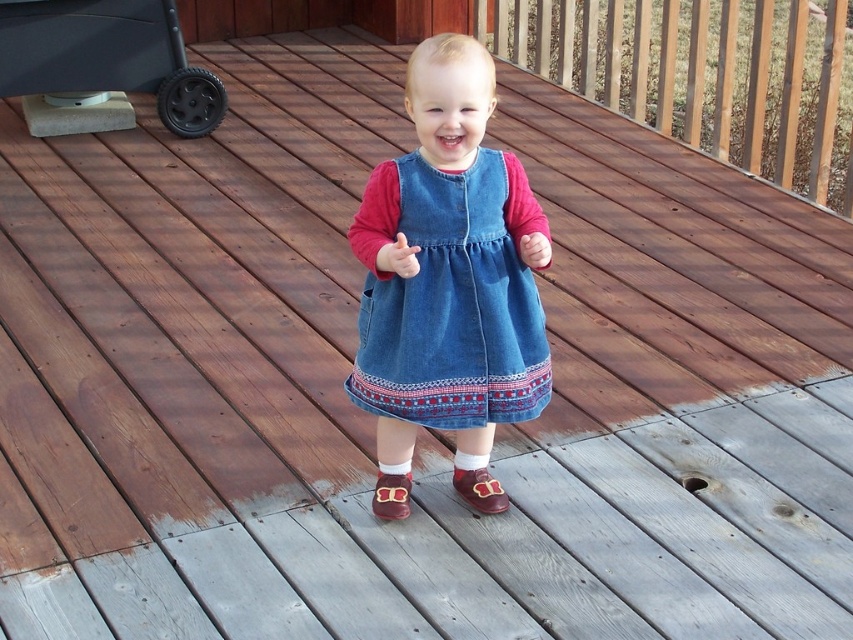
You are a fashion designer observing a child wearing a denim dress at center and brown suede shoe at center. Which clothing item is taller?

The denim dress at center has a greater height compared to the brown suede shoe at center.

The child is standing on a wooden deck. You need to determine if the denim dress at center is covering the brown suede shoe at center. Based on the scene description, what can you conclude?

The denim dress at center is positioned over brown suede shoe at center, so the denim dress at center is covering the brown suede shoe at center.

Looking at this image, you are a photographer setting up a shot of the child on the deck. You need to ensure both the black rubber baby carriage at upper left and the brown leather shoe at lower center are in focus. Given their positions, which object is closer to the camera and would require adjusting the focus first?

The black rubber baby carriage at upper left is closer to the camera than the brown leather shoe at lower center, so you should adjust the focus on the black rubber baby carriage at upper left first to ensure both are in focus.